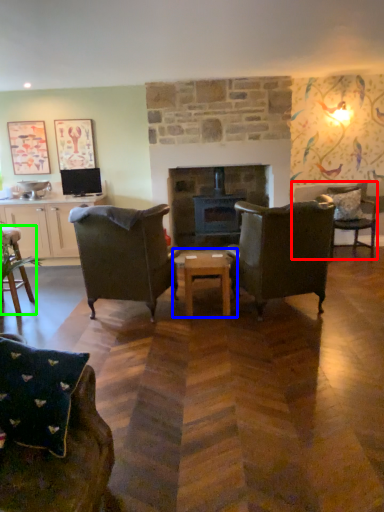
Question: Considering the real-world distances, which object is closest to chair (highlighted by a red box)? coffee table (highlighted by a blue box) or chair (highlighted by a green box).

Choices:
 (A) coffee table
 (B) chair

Answer: (A)